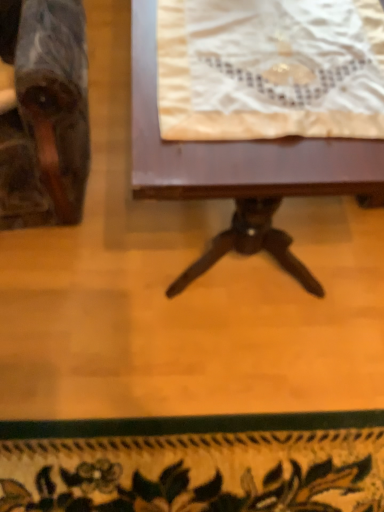
Question: From the image's perspective, does white lace cloth at upper center appear lower than marble-like wooden chair at left?

Choices:
 (A) yes
 (B) no

Answer: (A)

Question: Is white lace cloth at upper center behind marble-like wooden chair at left?

Choices:
 (A) no
 (B) yes

Answer: (B)

Question: Is white lace cloth at upper center not near marble-like wooden chair at left?

Choices:
 (A) yes
 (B) no

Answer: (B)

Question: Does white lace cloth at upper center appear on the left side of marble-like wooden chair at left?

Choices:
 (A) no
 (B) yes

Answer: (A)

Question: Considering the relative sizes of white lace cloth at upper center and marble-like wooden chair at left in the image provided, is white lace cloth at upper center smaller than marble-like wooden chair at left?

Choices:
 (A) no
 (B) yes

Answer: (B)

Question: Is marble-like wooden chair at left at the back of white lace cloth at upper center?

Choices:
 (A) no
 (B) yes

Answer: (A)

Question: Does wooden table at center come behind white lace cloth at upper center?

Choices:
 (A) no
 (B) yes

Answer: (A)

Question: Can you confirm if wooden table at center is shorter than white lace cloth at upper center?

Choices:
 (A) yes
 (B) no

Answer: (B)

Question: Are wooden table at center and white lace cloth at upper center far apart?

Choices:
 (A) yes
 (B) no

Answer: (B)

Question: Is wooden table at center bigger than white lace cloth at upper center?

Choices:
 (A) no
 (B) yes

Answer: (B)

Question: Considering the relative positions of wooden table at center and white lace cloth at upper center in the image provided, is wooden table at center to the right of white lace cloth at upper center from the viewer's perspective?

Choices:
 (A) no
 (B) yes

Answer: (A)

Question: From a real-world perspective, is wooden table at center over white lace cloth at upper center?

Choices:
 (A) yes
 (B) no

Answer: (B)

Question: Is white lace cloth at upper center located outside wooden table at center?

Choices:
 (A) no
 (B) yes

Answer: (A)